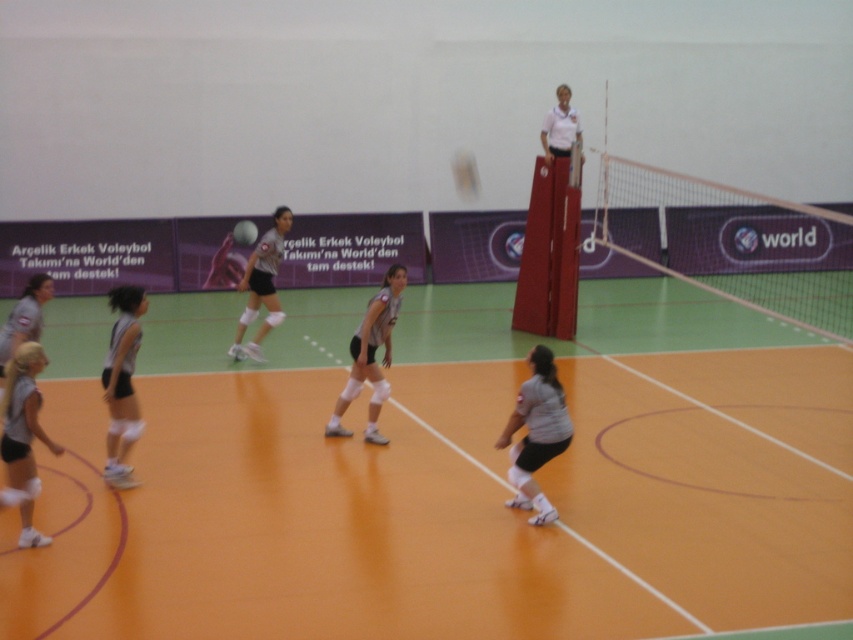
Is point (352, 368) more distant than point (260, 272)?

No, (352, 368) is closer to viewer.

Who is positioned more to the left, white knee pads at center or gray matte uniform at center?

gray matte uniform at center is more to the left.

Does point (370, 424) come farther from viewer compared to point (248, 260)?

No.

This screenshot has height=640, width=853. In order to click on white knee pads at center in this screenshot , I will do `click(370, 355)`.

Is gray matte uniform at lower right bigger than matte gray shorts at lower left?

Yes, gray matte uniform at lower right is bigger than matte gray shorts at lower left.

Between point (543, 433) and point (35, 531), which one is positioned behind?

Point (543, 433)

Where is `gray matte uniform at lower right`? gray matte uniform at lower right is located at coordinates (537, 433).

Can you confirm if matte gray shorts at lower left is shorter than gray matte uniform at lower left?

Yes.

Looking at this image, which is above, matte gray shorts at lower left or gray matte uniform at lower left?

gray matte uniform at lower left is higher up.

The image size is (853, 640). Identify the location of matte gray shorts at lower left. (24, 435).